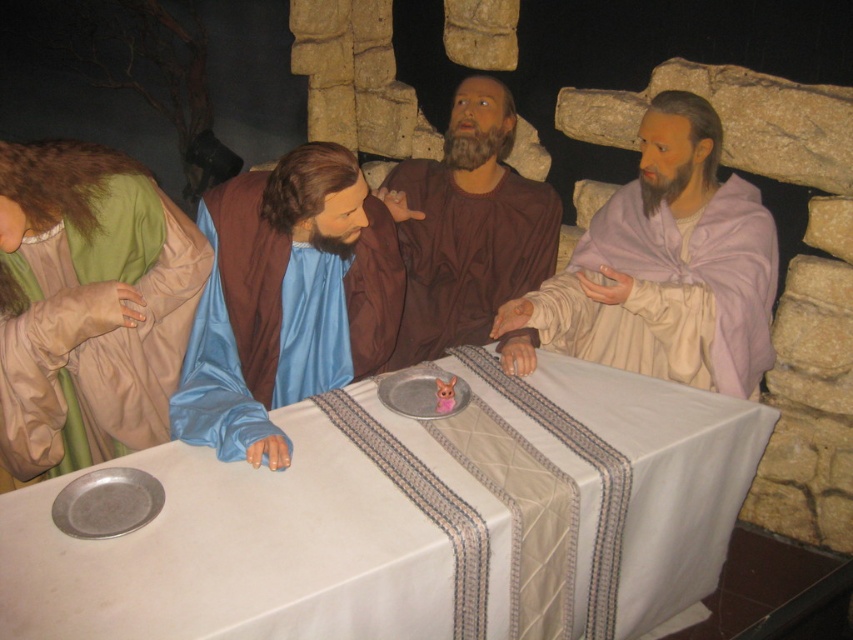
The height and width of the screenshot is (640, 853). In order to click on green matte robe at left in this screenshot , I will do `click(97, 332)`.

You are a GUI agent. You are given a task and a screenshot of the screen. Output one action in this format:
    pyautogui.click(x=<x>, y=<y>)
    Task: Click on the green matte robe at left
    This screenshot has height=640, width=853.
    Given the screenshot: What is the action you would take?
    pyautogui.click(x=97, y=332)

In the scene shown: Which of these two, blue satin robe at center or light purple silk robe at right, stands taller?

blue satin robe at center is taller.

Locate an element on the screen. blue satin robe at center is located at coordinates (236, 328).

Which is behind, point (248, 452) or point (740, 205)?

Positioned behind is point (740, 205).

Identify the location of blue satin robe at center. This screenshot has height=640, width=853. (236, 328).

Describe the element at coordinates (408, 520) in the screenshot. I see `white cloth at center` at that location.

Can you confirm if white cloth at center is shorter than light purple silk robe at right?

No, white cloth at center is not shorter than light purple silk robe at right.

Is point (608, 435) farther from viewer compared to point (757, 378)?

No, (608, 435) is closer to viewer.

I want to click on white cloth at center, so tap(408, 520).